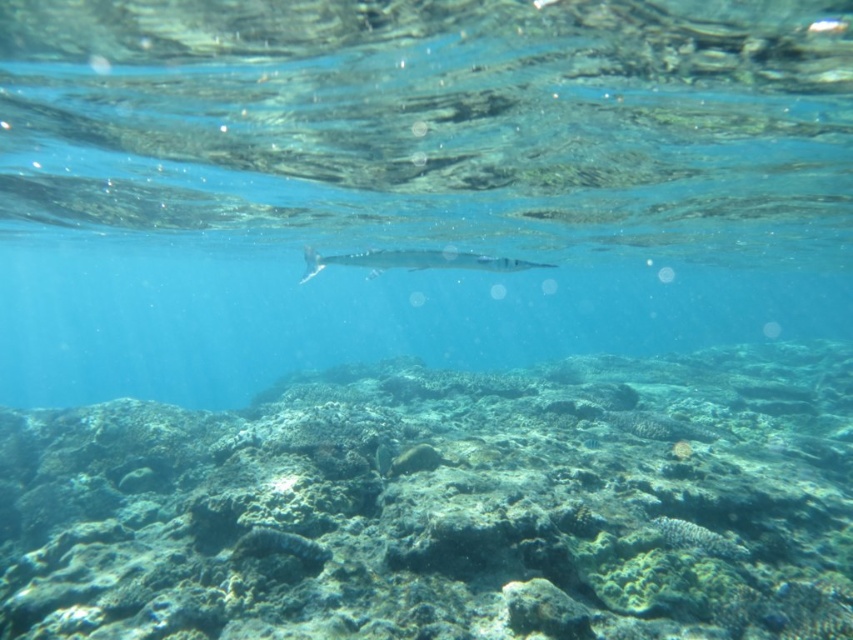
Question: Which point is closer to the camera taking this photo?

Choices:
 (A) (416, 465)
 (B) (438, 268)
 (C) (689, 24)

Answer: (A)

Question: Observing the image, what is the correct spatial positioning of clear blue water at center in reference to silver metallic needlefish at center?

Choices:
 (A) above
 (B) below

Answer: (B)

Question: Observing the image, what is the correct spatial positioning of rough textured coral reef at center in reference to silver metallic needlefish at center?

Choices:
 (A) below
 (B) above

Answer: (A)

Question: Which point appears closest to the camera in this image?

Choices:
 (A) (640, 618)
 (B) (531, 260)

Answer: (A)

Question: Which of the following is the farthest from the observer?

Choices:
 (A) clear blue water at center
 (B) silver metallic needlefish at center

Answer: (B)

Question: Does rough textured coral reef at center have a greater width compared to silver metallic needlefish at center?

Choices:
 (A) yes
 (B) no

Answer: (A)